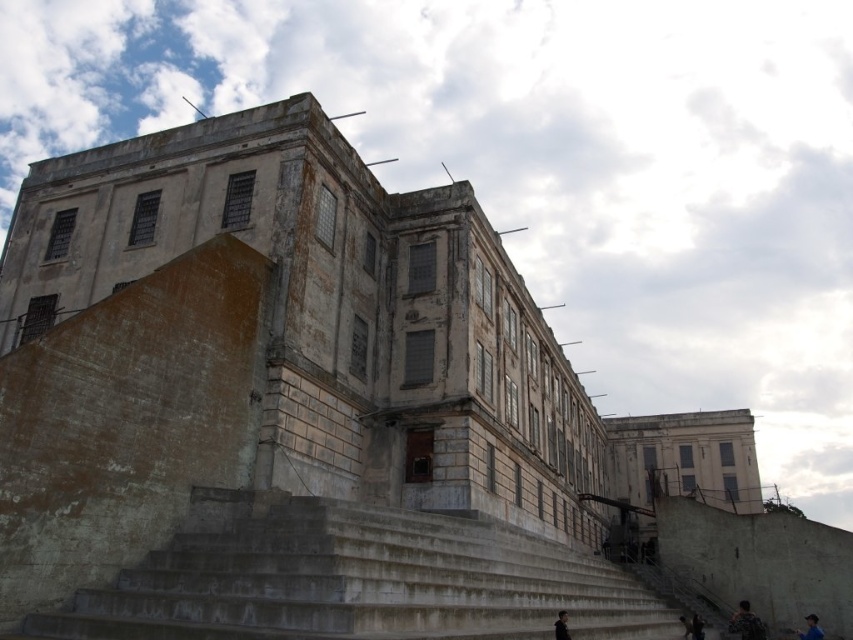
Question: Is concrete stairs at center to the right of dark blue fabric jacket at lower right from the viewer's perspective?

Choices:
 (A) yes
 (B) no

Answer: (B)

Question: Does concrete stairs at center have a greater width compared to dark hair at lower right?

Choices:
 (A) yes
 (B) no

Answer: (A)

Question: Which of the following is the closest to the observer?

Choices:
 (A) (815, 620)
 (B) (564, 632)

Answer: (B)

Question: Considering the real-world distances, which object is farthest from the dark gray concrete person at lower center?

Choices:
 (A) concrete stairs at center
 (B) blue fabric person at lower right
 (C) dark hair at lower right

Answer: (B)

Question: Which point is closer to the camera?

Choices:
 (A) blue fabric person at lower right
 (B) concrete stairs at center

Answer: (B)

Question: Is concrete stairs at center to the left of dark gray concrete person at lower center from the viewer's perspective?

Choices:
 (A) no
 (B) yes

Answer: (B)